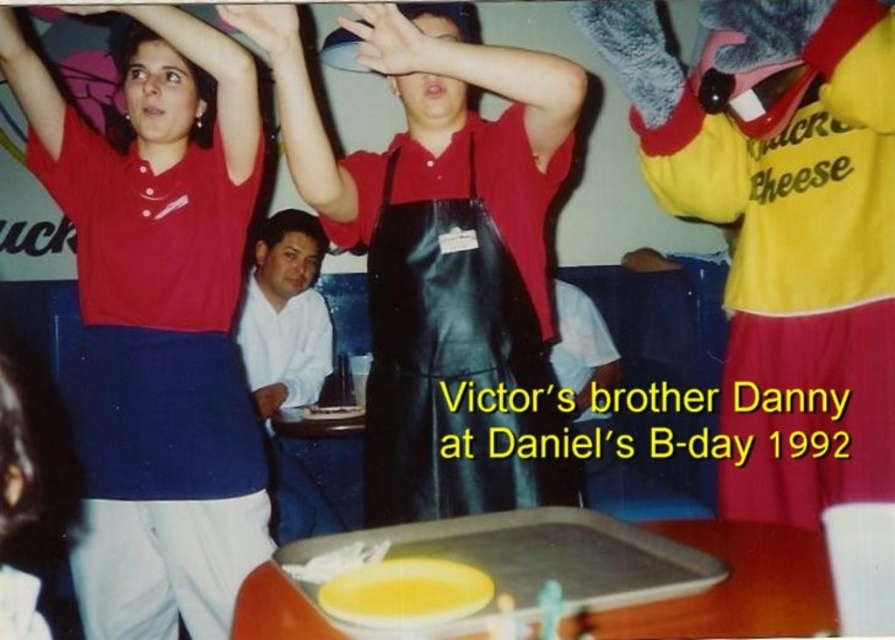
You are at Daniel 1992 birthday party and you see the white cotton shirt at lower left and the matte black hand at upper center. Which object is positioned lower in the image?

The white cotton shirt at lower left is positioned lower than the matte black hand at upper center.

Consider the image. Daniel is at a birthday party and wants to give a high five to both individuals wearing red polo shirts. The first individual is at point (197, 70) and the second is at point 0.333, 0.444. If Daniel is standing at the origin point 0,0, which individual is closer to him so he can give a high five first?

The first individual at point (197, 70) is closer to Daniel at 0,0 because the distance between them is shorter compared to the second individual at 0.333, 0.444.